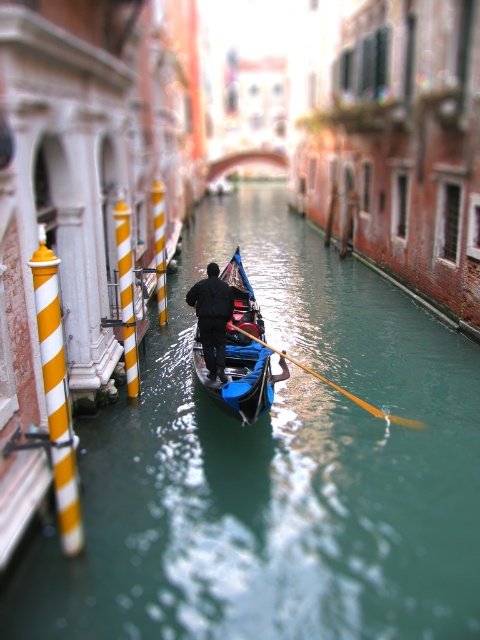
Question: Considering the real-world distances, which object is farthest from the shiny blue gondola at center?

Choices:
 (A) black matte jacket at center
 (B) green glossy water at center

Answer: (B)

Question: Among these objects, which one is farthest from the camera?

Choices:
 (A) green glossy water at center
 (B) black matte jacket at center
 (C) shiny blue gondola at center

Answer: (B)

Question: Does shiny blue gondola at center lie in front of black matte jacket at center?

Choices:
 (A) no
 (B) yes

Answer: (B)

Question: Does shiny blue gondola at center appear under black matte jacket at center?

Choices:
 (A) no
 (B) yes

Answer: (A)

Question: Among these objects, which one is nearest to the camera?

Choices:
 (A) shiny blue gondola at center
 (B) black matte jacket at center

Answer: (A)

Question: Is shiny blue gondola at center smaller than black matte jacket at center?

Choices:
 (A) no
 (B) yes

Answer: (A)